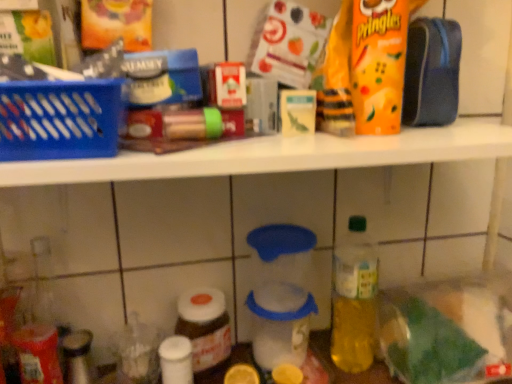
What do you see at coordinates (276, 156) in the screenshot? This screenshot has height=384, width=512. I see `white plastic shelf at upper center` at bounding box center [276, 156].

At what (x,y) coordinates should I click in order to perform the action: click on yellow matte lemon at lower center, acting as the second lemon starting from the right. Please return your answer as a coordinate pair (x, y). The height and width of the screenshot is (384, 512). Looking at the image, I should click on (241, 374).

The image size is (512, 384). What are the coordinates of `blue plastic basket at left` in the screenshot? It's located at (59, 119).

I want to click on matte brown jar at lower left, which is counted as the 2th bottle, starting from the left, so [205, 328].

What do you see at coordinates (205, 328) in the screenshot? I see `matte brown jar at lower left, which is counted as the 2th bottle, starting from the right` at bounding box center [205, 328].

What do you see at coordinates (137, 353) in the screenshot? I see `translucent plastic container at lower left, arranged as the 1th bottle when viewed from the left` at bounding box center [137, 353].

What is the approximate width of yellow matte lemon at lower center, which is counted as the second lemon, starting from the left?

2.09 inches.

This screenshot has height=384, width=512. In order to click on transparent plastic container at center in this screenshot , I will do [280, 323].

Is green plastic bottle at center-right, positioned as the 3th bottle in left-to-right order, bigger than translucent plastic container at lower left, arranged as the third bottle when viewed from the right?

Yes, green plastic bottle at center-right, positioned as the 3th bottle in left-to-right order, is bigger than translucent plastic container at lower left, arranged as the third bottle when viewed from the right.

Can you confirm if green plastic bottle at center-right, which appears as the 1th bottle when viewed from the right, is positioned to the left of translucent plastic container at lower left, arranged as the third bottle when viewed from the right?

No.

Where is `the 2nd bottle above the translucent plastic container at lower left, arranged as the 1th bottle when viewed from the left (from the image's perspective)`? This screenshot has width=512, height=384. the 2nd bottle above the translucent plastic container at lower left, arranged as the 1th bottle when viewed from the left (from the image's perspective) is located at coordinates (354, 300).

Considering the sizes of green plastic bottle at center-right, positioned as the 3th bottle in left-to-right order, and translucent plastic container at lower left, arranged as the 1th bottle when viewed from the left, in the image, is green plastic bottle at center-right, positioned as the 3th bottle in left-to-right order, taller or shorter than translucent plastic container at lower left, arranged as the 1th bottle when viewed from the left,?

In the image, green plastic bottle at center-right, positioned as the 3th bottle in left-to-right order, appears to be taller than translucent plastic container at lower left, arranged as the 1th bottle when viewed from the left.

You are a GUI agent. You are given a task and a screenshot of the screen. Output one action in this format:
    pyautogui.click(x=<x>, y=<y>)
    Task: Click on the basket in front of the green plastic bottle at center-right, positioned as the 3th bottle in left-to-right order
    The image size is (512, 384).
    Given the screenshot: What is the action you would take?
    pyautogui.click(x=59, y=119)

From a real-world perspective, is green plastic bottle at center-right, positioned as the 3th bottle in left-to-right order, positioned above or below blue plastic basket at left?

green plastic bottle at center-right, positioned as the 3th bottle in left-to-right order, is situated lower than blue plastic basket at left in the real world.

Between point (353, 330) and point (101, 118), which one is positioned behind?

Point (353, 330)

Considering the positions of objects green plastic bottle at center-right, positioned as the 3th bottle in left-to-right order, and blue plastic basket at left in the image provided, who is more to the left, green plastic bottle at center-right, positioned as the 3th bottle in left-to-right order, or blue plastic basket at left?

blue plastic basket at left is more to the left.

Is point (360, 352) in front of point (390, 51)?

No, (360, 352) is behind (390, 51).

Measure the distance from green plastic bottle at center-right, positioned as the 3th bottle in left-to-right order, to orange matte pringles at upper right.

A distance of 13.14 inches exists between green plastic bottle at center-right, positioned as the 3th bottle in left-to-right order, and orange matte pringles at upper right.

Considering the relative sizes of green plastic bottle at center-right, positioned as the 3th bottle in left-to-right order, and orange matte pringles at upper right in the image provided, is green plastic bottle at center-right, positioned as the 3th bottle in left-to-right order, smaller than orange matte pringles at upper right?

No.

Is green plastic bottle at center-right, positioned as the 3th bottle in left-to-right order, next to orange matte pringles at upper right?

No, green plastic bottle at center-right, positioned as the 3th bottle in left-to-right order, is not next to orange matte pringles at upper right.

Is green plastic bag at lower right with matte brown jar at lower left, which is counted as the 2th bottle, starting from the right?

No, green plastic bag at lower right is not with matte brown jar at lower left, which is counted as the 2th bottle, starting from the right.

Does point (447, 361) appear closer or farther from the camera than point (195, 375)?

Point (447, 361) is closer to the camera than point (195, 375).

Which object is positioned more to the left, green plastic bag at lower right or matte brown jar at lower left, which is counted as the 2th bottle, starting from the right?

matte brown jar at lower left, which is counted as the 2th bottle, starting from the right.

How different are the orientations of green plastic bag at lower right and matte brown jar at lower left, which is counted as the 2th bottle, starting from the right, in degrees?

The angular difference between green plastic bag at lower right and matte brown jar at lower left, which is counted as the 2th bottle, starting from the right, is 5.79 degrees.

From the image's perspective, relative to yellow matte lemon at lower center, arranged as the first lemon when viewed from the left, is translucent plastic container at lower left, arranged as the third bottle when viewed from the right, above or below?

Based on their image positions, translucent plastic container at lower left, arranged as the third bottle when viewed from the right, is located above yellow matte lemon at lower center, arranged as the first lemon when viewed from the left.

Which is behind, translucent plastic container at lower left, arranged as the 1th bottle when viewed from the left, or yellow matte lemon at lower center, acting as the second lemon starting from the right?

Positioned behind is translucent plastic container at lower left, arranged as the 1th bottle when viewed from the left.

Considering the positions of objects translucent plastic container at lower left, arranged as the 1th bottle when viewed from the left, and yellow matte lemon at lower center, acting as the second lemon starting from the right, in the image provided, who is more to the right, translucent plastic container at lower left, arranged as the 1th bottle when viewed from the left, or yellow matte lemon at lower center, acting as the second lemon starting from the right,?

Positioned to the right is yellow matte lemon at lower center, acting as the second lemon starting from the right.

How many degrees apart are the facing directions of translucent plastic container at lower left, arranged as the third bottle when viewed from the right, and yellow matte lemon at lower center, arranged as the first lemon when viewed from the left?

The facing directions of translucent plastic container at lower left, arranged as the third bottle when viewed from the right, and yellow matte lemon at lower center, arranged as the first lemon when viewed from the left, are 12.2 degrees apart.

Is orange matte pringles at upper right completely or partially outside of green plastic bottle at center-right, positioned as the 3th bottle in left-to-right order?

Yes, orange matte pringles at upper right is located beyond the bounds of green plastic bottle at center-right, positioned as the 3th bottle in left-to-right order.

Does point (394, 88) come farther from viewer compared to point (364, 245)?

No, (394, 88) is closer to viewer.

Is orange matte pringles at upper right in front of or behind green plastic bottle at center-right, which appears as the 1th bottle when viewed from the right, in the image?

orange matte pringles at upper right is positioned closer to the viewer than green plastic bottle at center-right, which appears as the 1th bottle when viewed from the right.

Find the location of a particular element. The image size is (512, 384). the 1st bottle below the orange matte pringles at upper right (from a real-world perspective) is located at coordinates (x=354, y=300).

How many degrees apart are the facing directions of yellow matte lemon at lower center, the 1th lemon positioned from the right, and transparent plastic container at center?

Result: 0.000515 degrees separate the facing orientations of yellow matte lemon at lower center, the 1th lemon positioned from the right, and transparent plastic container at center.

From the image's perspective, between yellow matte lemon at lower center, which is counted as the second lemon, starting from the left, and transparent plastic container at center, who is located below?

yellow matte lemon at lower center, which is counted as the second lemon, starting from the left.

Which of these two, yellow matte lemon at lower center, the 1th lemon positioned from the right, or transparent plastic container at center, is bigger?

Bigger between the two is transparent plastic container at center.

The image size is (512, 384). Find the location of `glass jar behind the yellow matte lemon at lower center, which is counted as the second lemon, starting from the left`. glass jar behind the yellow matte lemon at lower center, which is counted as the second lemon, starting from the left is located at coordinates (280, 323).

Locate an element on the screen. The width and height of the screenshot is (512, 384). bottle that is the 1st one when counting backward from the green plastic bottle at center-right, which appears as the 1th bottle when viewed from the right is located at coordinates (137, 353).

Which bottle is the 3rd one when counting from the right side of the blue plastic basket at left? Please provide its 2D coordinates.

[(354, 300)]

In the scene shown: Considering their positions, is orange matte pringles at upper right positioned closer to blue plastic basket at left than green plastic bag at lower right?

orange matte pringles at upper right lies closer to blue plastic basket at left than the other object.

Looking at this image, based on their spatial positions, is green plastic bottle at center-right, positioned as the 3th bottle in left-to-right order, or yellow matte lemon at lower center, the 1th lemon positioned from the right, closer to blue plastic basket at left?

green plastic bottle at center-right, positioned as the 3th bottle in left-to-right order, is closer to blue plastic basket at left.

Considering their positions, is matte brown jar at lower left, which is counted as the 2th bottle, starting from the right, positioned further to orange matte pringles at upper right than yellow matte lemon at lower center, arranged as the first lemon when viewed from the left?

Based on the image, yellow matte lemon at lower center, arranged as the first lemon when viewed from the left, appears to be further to orange matte pringles at upper right.

From the image, which object appears to be farther from yellow matte lemon at lower center, arranged as the first lemon when viewed from the left, white plastic shelf at upper center or green plastic bottle at center-right, positioned as the 3th bottle in left-to-right order?

The object further to yellow matte lemon at lower center, arranged as the first lemon when viewed from the left, is white plastic shelf at upper center.

From the image, which object appears to be nearer to green plastic bottle at center-right, positioned as the 3th bottle in left-to-right order, blue plastic basket at left or orange matte pringles at upper right?

orange matte pringles at upper right is closer to green plastic bottle at center-right, positioned as the 3th bottle in left-to-right order.

Considering their positions, is green plastic bag at lower right positioned further to orange matte pringles at upper right than transparent plastic container at center?

The object further to orange matte pringles at upper right is green plastic bag at lower right.

When comparing their distances from matte brown jar at lower left, which is counted as the 2th bottle, starting from the left, does translucent plastic container at lower left, arranged as the third bottle when viewed from the right, or blue plastic basket at left seem further?

The object further to matte brown jar at lower left, which is counted as the 2th bottle, starting from the left, is blue plastic basket at left.

When comparing their distances from orange matte pringles at upper right, does yellow matte lemon at lower center, arranged as the first lemon when viewed from the left, or yellow matte lemon at lower center, which is counted as the second lemon, starting from the left, seem closer?

Among the two, yellow matte lemon at lower center, which is counted as the second lemon, starting from the left, is located nearer to orange matte pringles at upper right.

Where is `glass jar between yellow matte lemon at lower center, acting as the second lemon starting from the right, and yellow matte lemon at lower center, which is counted as the second lemon, starting from the left, in the horizontal direction`? glass jar between yellow matte lemon at lower center, acting as the second lemon starting from the right, and yellow matte lemon at lower center, which is counted as the second lemon, starting from the left, in the horizontal direction is located at coordinates (280, 323).

At what (x,y) coordinates should I click in order to perform the action: click on shelf between blue plastic basket at left and green plastic bottle at center-right, which appears as the 1th bottle when viewed from the right, from left to right. Please return your answer as a coordinate pair (x, y). Looking at the image, I should click on (276, 156).

The image size is (512, 384). In order to click on glass jar located between translucent plastic container at lower left, arranged as the third bottle when viewed from the right, and green plastic bag at lower right in the left-right direction in this screenshot , I will do `click(280, 323)`.

Where is `shelf between matte brown jar at lower left, which is counted as the 2th bottle, starting from the right, and green plastic bag at lower right`? This screenshot has height=384, width=512. shelf between matte brown jar at lower left, which is counted as the 2th bottle, starting from the right, and green plastic bag at lower right is located at coordinates (276, 156).